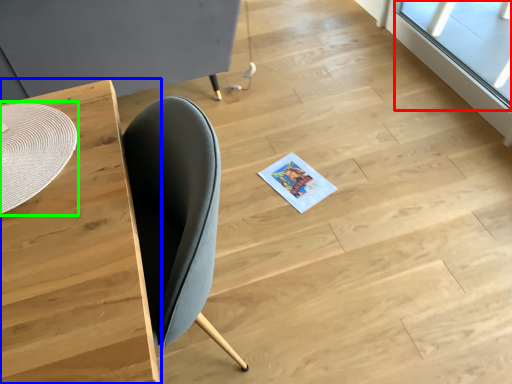
Question: Which object is positioned farthest from window (highlighted by a red box)? Select from table (highlighted by a blue box) and round table (highlighted by a green box).

Choices:
 (A) table
 (B) round table

Answer: (B)